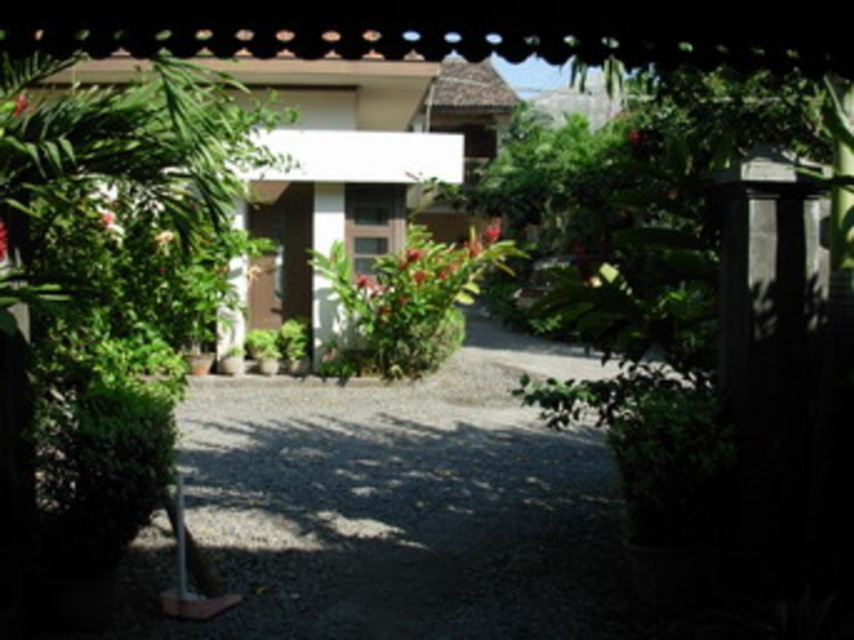
You are a gardener who needs to place a new decorative statue that requires 3 meters of space. You see the green leafy plant at left and the green leafy bush at center. Which one has enough space around it to accommodate the statue?

The green leafy bush at center has a larger width than the green leafy plant at left, so it likely has enough space to accommodate the statue.

You are standing at the entrance of the building and want to walk towards the point that is closer to you. Which point should you head towards, point (x=156, y=422) or point (x=474, y=243)?

Point (x=156, y=422) is closer to the viewer than point (x=474, y=243), so you should head towards point (x=156, y=422).